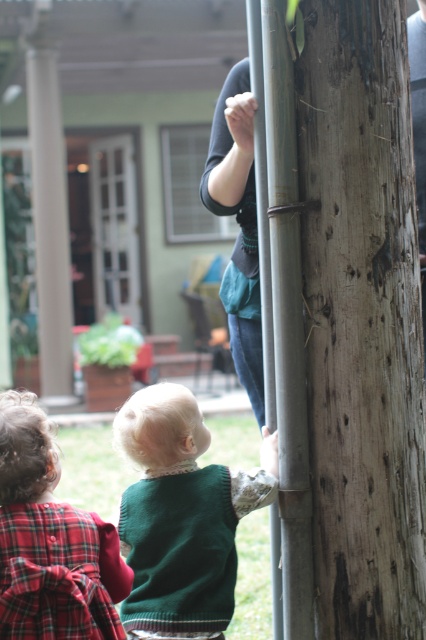
You are a parent trying to locate your child who is near the wooden textured tree trunk at right and the silver metallic pole at center. Which object is nearer to you if you are standing at the entrance of the house?

The wooden textured tree trunk at right is closer to you than the silver metallic pole at center because it is nearer to the viewer according to the scene description.

Looking at this image, you are a parent trying to decide if your child can reach the top of the silver metallic pole at center while wearing the plaid fabric dress at lower left. Based on their sizes, can the child reach the top?

The silver metallic pole at center has a larger size compared to plaid fabric dress at lower left. Since the pole is larger, the child wearing the plaid fabric dress at lower left can likely reach the top as the pole is taller than the dress.